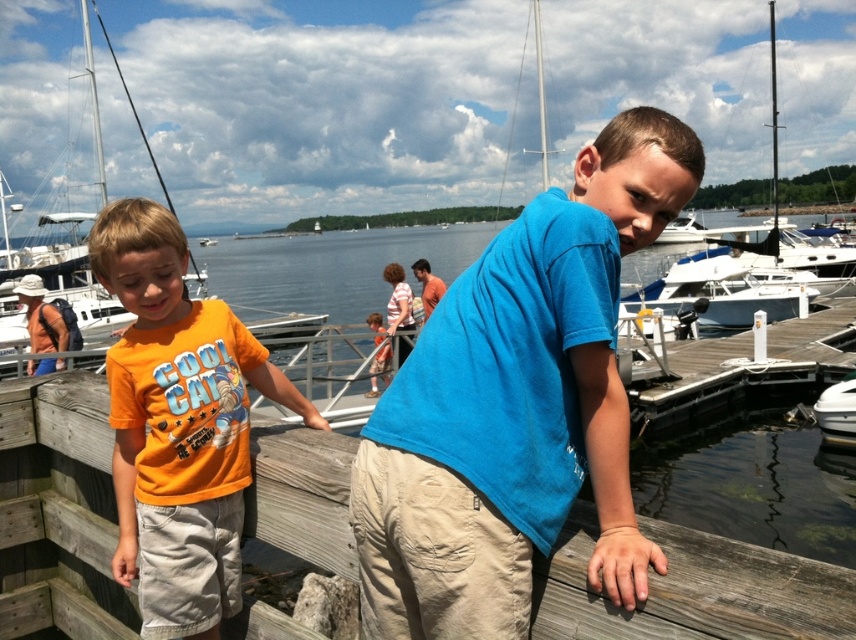
Does point (488, 490) come farther from viewer compared to point (373, 388)?

No, (488, 490) is closer to viewer.

Who is more forward, (x=583, y=456) or (x=376, y=385)?

Point (x=583, y=456)

I want to click on blue cotton shirt at center, so click(x=516, y=406).

Can you confirm if wooden dock at center is wider than orange cotton shirt at left?

No.

Is wooden dock at center taller than orange cotton shirt at left?

No.

This screenshot has width=856, height=640. Describe the element at coordinates (694, 589) in the screenshot. I see `wooden dock at center` at that location.

This screenshot has height=640, width=856. Identify the location of wooden dock at center. (694, 589).

Who is taller, wooden dock at center or striped cotton shirt at center?

striped cotton shirt at center is taller.

Which is below, wooden dock at center or striped cotton shirt at center?

wooden dock at center

Measure the distance between point (849, 600) and camera.

A distance of 4.30 feet exists between point (849, 600) and camera.

Locate an element on the screen. The height and width of the screenshot is (640, 856). wooden dock at center is located at coordinates (694, 589).